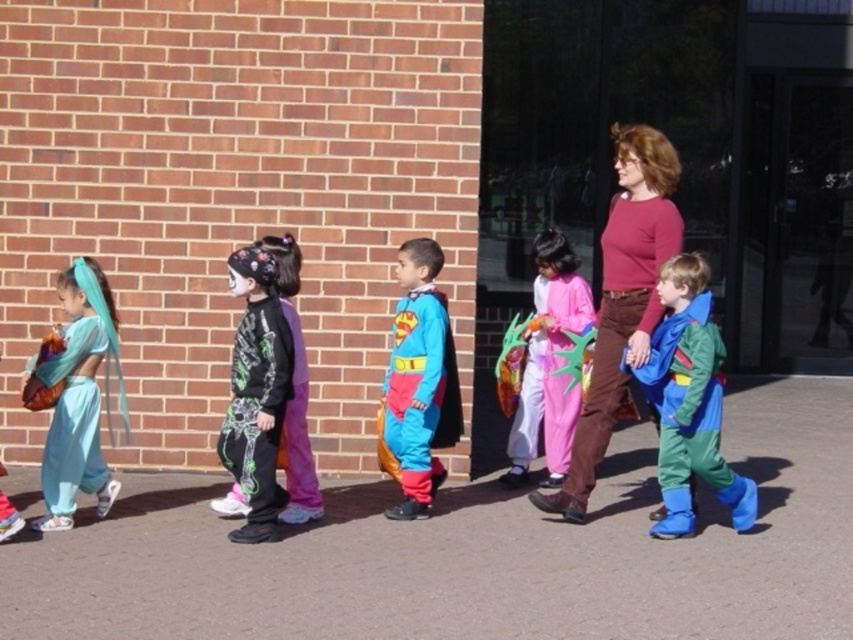
You are a photographer trying to capture a group photo of the children. You want to ensure that all the children are visible in the photo. Given that the black matte costume at center is behind the matte pink sweater at center, which child should you ask to move forward to ensure they are not blocked?

The black matte costume at center is behind the matte pink sweater at center, so you should ask the child in the black matte costume at center to move forward so they are not blocked by the matte pink sweater at center.

You are a photographer standing at the sidewalk. You want to take a photo of both the superman costume at center and the pink fabric costume at center. Which costume should you focus on first to ensure both are in focus?

The superman costume at center is closer to the viewer than the pink fabric costume at center, so focus on the superman costume at center first to ensure both are in focus.

You are standing at the entrance of the sidewalk and want to find the matte pink sweater at center. Based on the coordinates provided in the Objects Description, in which direction should you look relative to the brick wall?

The matte pink sweater at center is located at coordinates point (622, 298). Since the coordinates are relative to the image, the sweater is positioned towards the center of the image, which would be in the middle section of the brick wall.